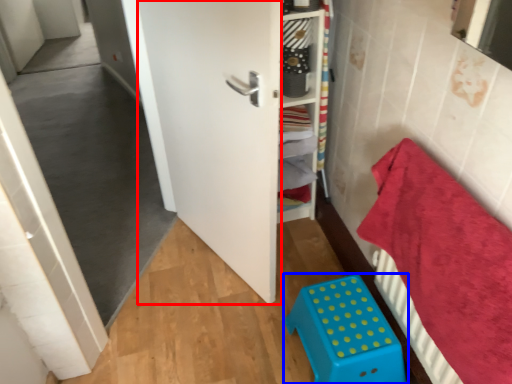
Question: Which of the following is the farthest to the observer, door (highlighted by a red box) or furniture (highlighted by a blue box)?

Choices:
 (A) door
 (B) furniture

Answer: (B)